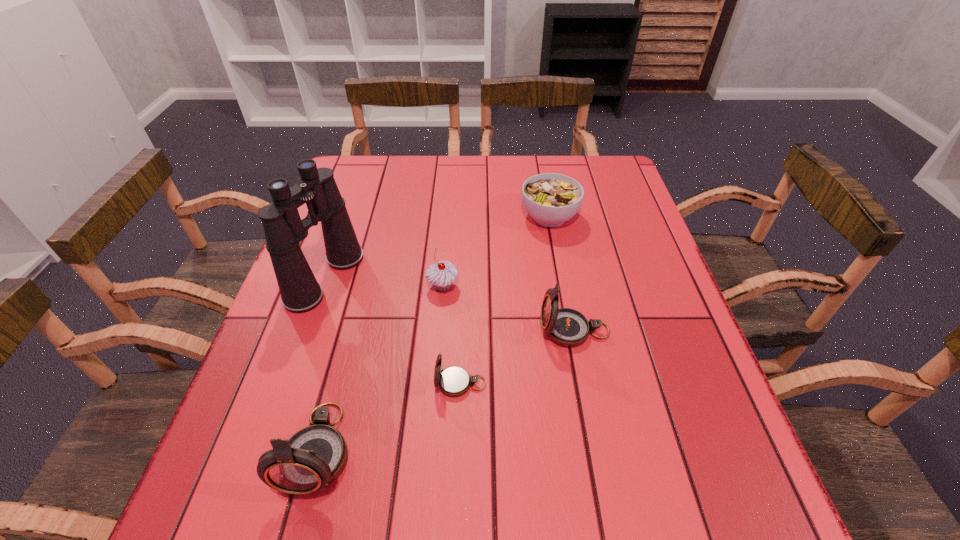
You are a GUI agent. You are given a task and a screenshot of the screen. Output one action in this format:
    pyautogui.click(x=<x>, y=<y>)
    Task: Click on the compass that stands as the third closest to the farthest object
    
    Given the screenshot: What is the action you would take?
    pyautogui.click(x=313, y=457)

Identify which compass is the closest to the farthest object. Please provide its 2D coordinates. Your answer should be formatted as a tuple, i.e. [(x, y)], where the tuple contains the x and y coordinates of a point satisfying the conditions above.

[(567, 327)]

Find the location of a particular element. free spot that satisfies the following two spatial constraints: 1. on the back side of the binoculars; 2. on the right side of the soup bowl is located at coordinates (347, 217).

Where is `vacant region that satisfies the following two spatial constraints: 1. on the face of the farthest compass; 2. on the face of the nearest compass`? This screenshot has width=960, height=540. vacant region that satisfies the following two spatial constraints: 1. on the face of the farthest compass; 2. on the face of the nearest compass is located at coordinates [597, 449].

This screenshot has height=540, width=960. Identify the location of vacant space that satisfies the following two spatial constraints: 1. on the back side of the binoculars; 2. on the left side of the soup bowl. (347, 217).

You are a GUI agent. You are given a task and a screenshot of the screen. Output one action in this format:
    pyautogui.click(x=<x>, y=<y>)
    Task: Click on the free spot that satisfies the following two spatial constraints: 1. on the back side of the farthest object; 2. on the left side of the binoculars
    
    Given the screenshot: What is the action you would take?
    pyautogui.click(x=347, y=217)